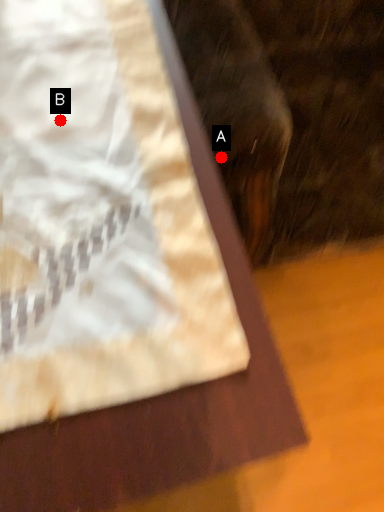
Question: Two points are circled on the image, labeled by A and B beside each circle. Among these points, which one is nearest to the camera?

Choices:
 (A) A is closer
 (B) B is closer

Answer: (B)